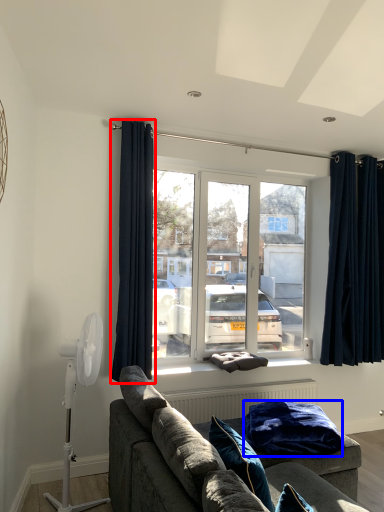
Question: Which point is closer to the camera, curtain (highlighted by a red box) or blanket (highlighted by a blue box)?

Choices:
 (A) curtain
 (B) blanket

Answer: (B)